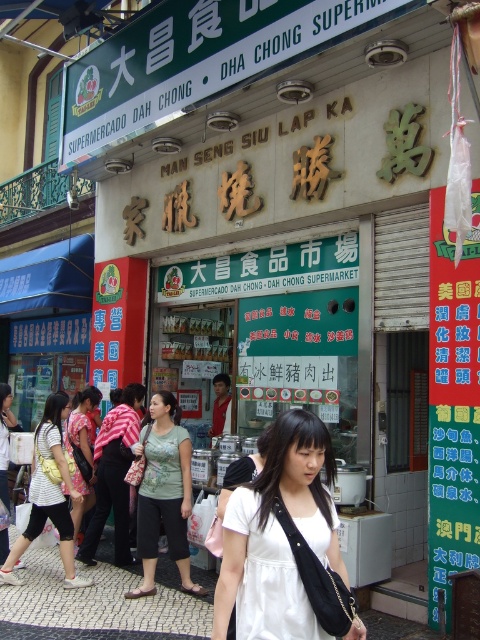
Between point (288, 548) and point (142, 483), which one is positioned behind?

The point (142, 483) is more distant.

Is white matte shirt at center thinner than green cotton shirt at center?

Yes, white matte shirt at center is thinner than green cotton shirt at center.

Between point (230, 568) and point (190, 476), which one is positioned in front?

Point (230, 568)

Find the location of a particular element. white matte shirt at center is located at coordinates (278, 536).

Who is more distant from viewer, (130, 618) or (70, 541)?

The point (70, 541) is more distant.

Does white mosaic pavement at lower center lie behind light green cotton shirt at lower left?

That is False.

You are a GUI agent. You are given a task and a screenshot of the screen. Output one action in this format:
    pyautogui.click(x=<x>, y=<y>)
    Task: Click on the white mosaic pavement at lower center
    
    Given the screenshot: What is the action you would take?
    pyautogui.click(x=105, y=602)

Where is `white mosaic pavement at lower center`? This screenshot has width=480, height=640. white mosaic pavement at lower center is located at coordinates (105, 602).

Between point (50, 499) and point (4, 401), which one is positioned in front?

Point (50, 499) is in front.

Does point (36, 458) come behind point (0, 444)?

That is False.

Locate an element on the screen. light green cotton shirt at lower left is located at coordinates (48, 493).